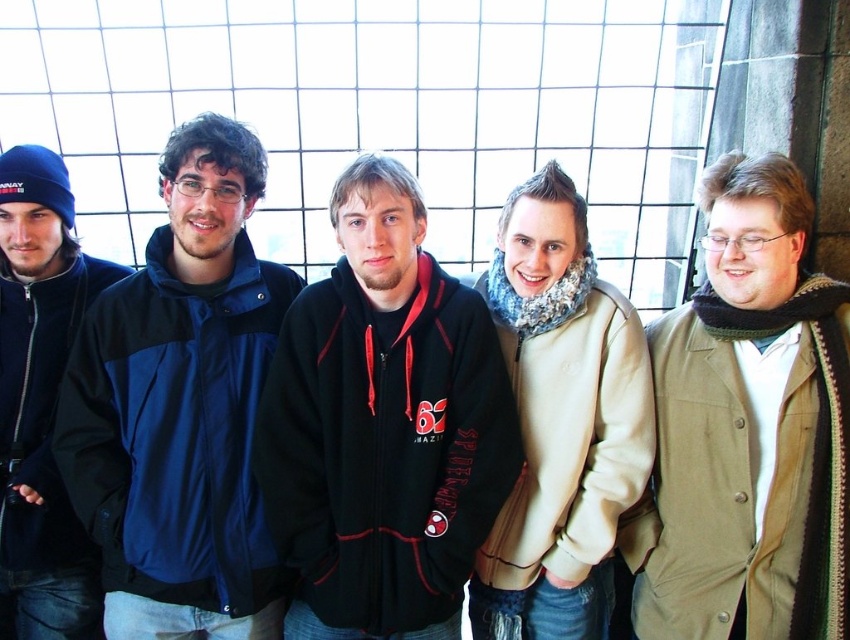
Question: Which point is farther to the camera?

Choices:
 (A) khaki cotton sweatshirt at right
 (B) black fleece sweatshirt at center
 (C) beige fleece sweatshirt at center

Answer: (C)

Question: Which of these objects is positioned farthest from the dark blue fleece jacket at left?

Choices:
 (A) khaki cotton sweatshirt at right
 (B) black fleece sweatshirt at center

Answer: (A)

Question: Does khaki cotton sweatshirt at right have a larger size compared to beige fleece sweatshirt at center?

Choices:
 (A) no
 (B) yes

Answer: (B)

Question: In this image, where is black fleece sweatshirt at center located relative to khaki cotton sweatshirt at right?

Choices:
 (A) below
 (B) above

Answer: (B)

Question: Estimate the real-world distances between objects in this image. Which object is closer to the blue fabric jacket at center?

Choices:
 (A) dark blue fleece jacket at left
 (B) beige fleece sweatshirt at center
 (C) khaki cotton sweatshirt at right
 (D) black fleece sweatshirt at center

Answer: (D)

Question: Does dark blue fleece jacket at left appear on the right side of beige fleece sweatshirt at center?

Choices:
 (A) no
 (B) yes

Answer: (A)